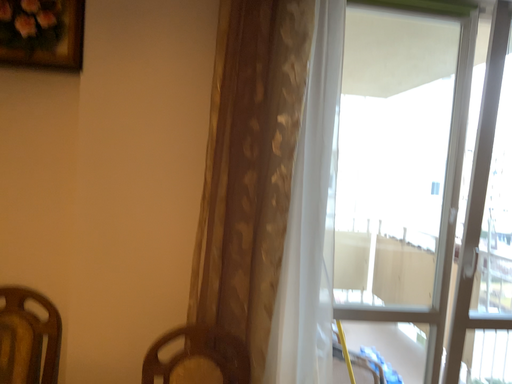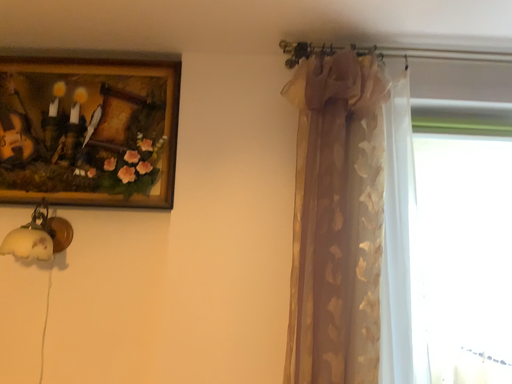
Question: Which way did the camera rotate in the video?

Choices:
 (A) rotated upward
 (B) rotated downward

Answer: (A)